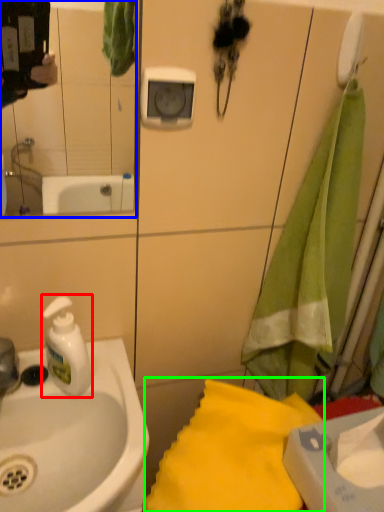
Question: Based on their relative distances, which object is nearer to soap dispenser (highlighted by a red box)? Choose from mirror (highlighted by a blue box) and beach towel (highlighted by a green box).

Choices:
 (A) mirror
 (B) beach towel

Answer: (B)